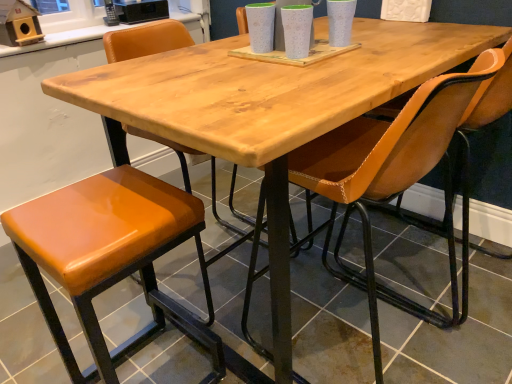
Question: In terms of size, does orange leather chair at center, which is counted as the 2th chair, starting from the front, appear bigger or smaller than leatherette chair at center, which is counted as the 1th chair, starting from the bottom?

Choices:
 (A) big
 (B) small

Answer: (B)

Question: From the image's perspective, is orange leather chair at center, acting as the second chair starting from the bottom, above or below leatherette chair at center, which ranks as the first chair in front-to-back order?

Choices:
 (A) below
 (B) above

Answer: (B)

Question: Based on their relative distances, which object is farther from the orange leather chair at center, arranged as the 1th chair when viewed from the back?

Choices:
 (A) orange leather stool at lower left
 (B) leatherette chair at center, which ranks as the first chair in front-to-back order

Answer: (A)

Question: Which object is positioned closest to the orange leather stool at lower left?

Choices:
 (A) orange leather chair at center, acting as the second chair starting from the bottom
 (B) leatherette chair at center, which is counted as the 1th chair, starting from the bottom

Answer: (B)